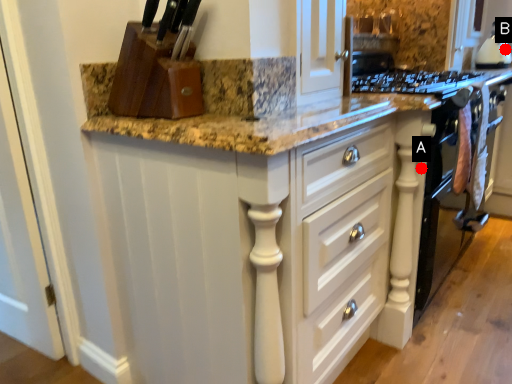
Question: Two points are circled on the image, labeled by A and B beside each circle. Which point is closer to the camera?

Choices:
 (A) A is closer
 (B) B is closer

Answer: (A)